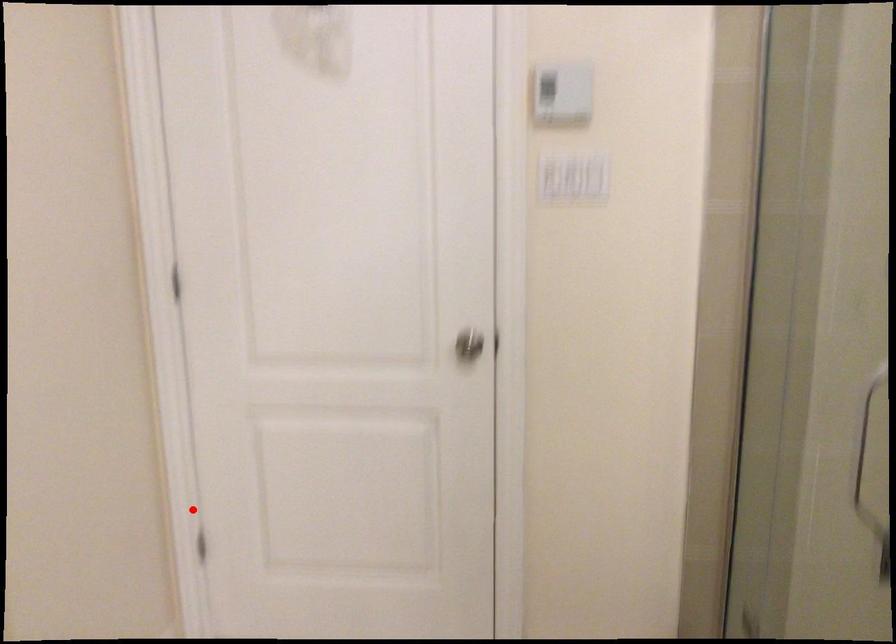
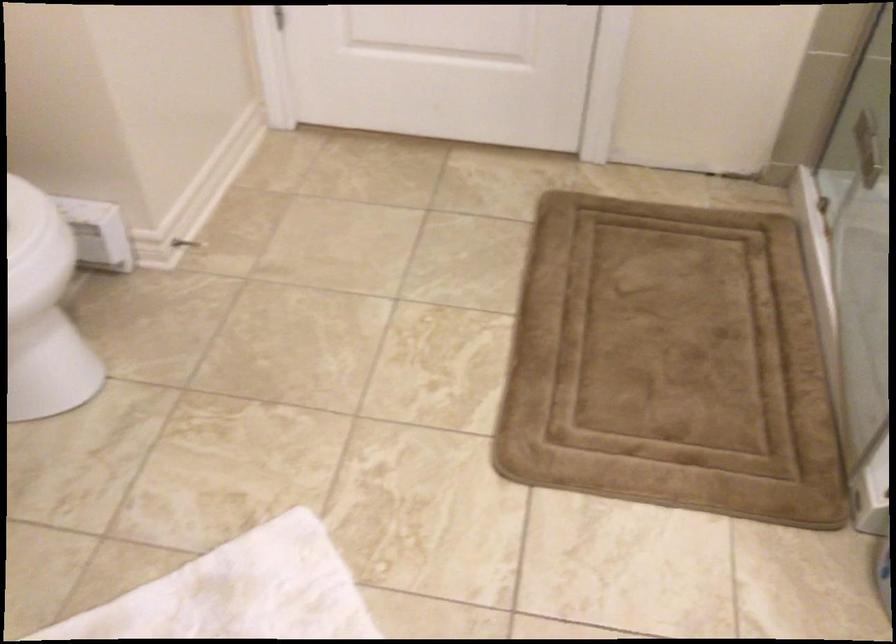
Locate, in the second image, the point that corresponds to the highlighted location in the first image.

(274, 17)